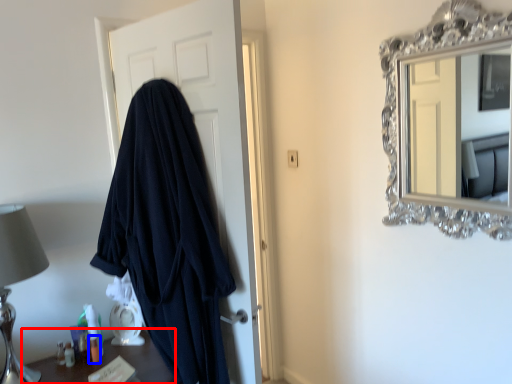
Question: Among these objects, which one is farthest to the camera, furniture (highlighted by a red box) or toiletry (highlighted by a blue box)?

Choices:
 (A) furniture
 (B) toiletry

Answer: (B)